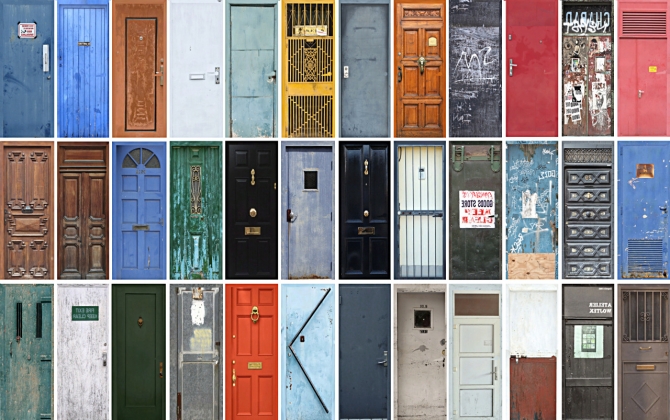
This screenshot has height=420, width=670. In order to click on blue door in this screenshot , I will do `click(27, 84)`, `click(82, 86)`, `click(139, 204)`, `click(312, 228)`, `click(535, 225)`, `click(636, 228)`, `click(317, 365)`.